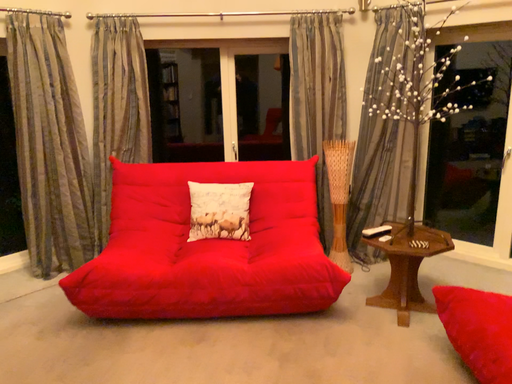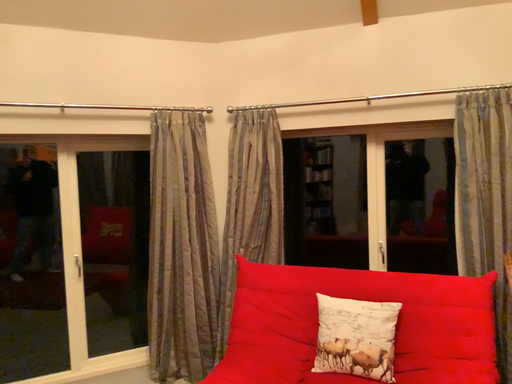
Question: Which way did the camera rotate in the video?

Choices:
 (A) rotated right
 (B) rotated left

Answer: (B)